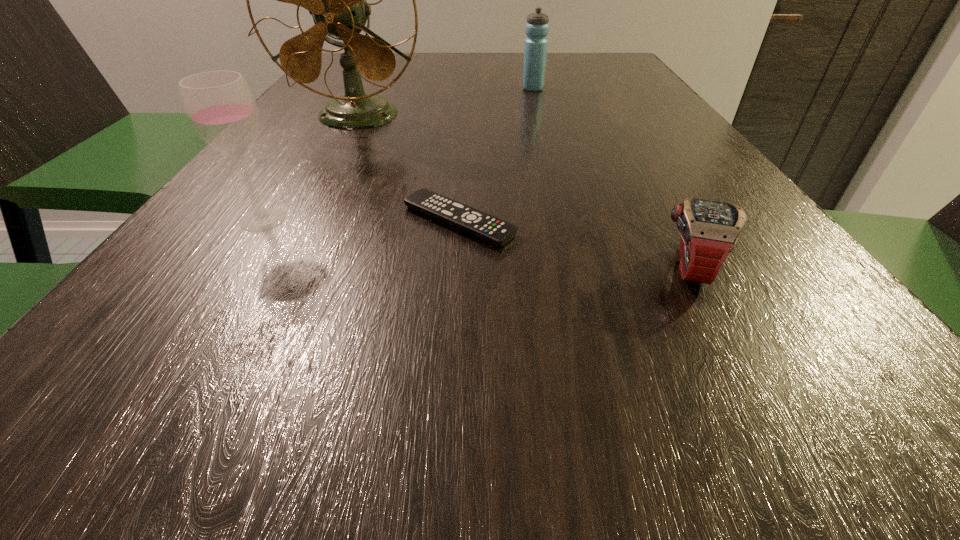
Where is `the tallest object`? The width and height of the screenshot is (960, 540). the tallest object is located at coordinates (336, 0).

Find the location of `the second farthest object`. the second farthest object is located at coordinates (336, 0).

The image size is (960, 540). Find the location of `wineglass`. wineglass is located at coordinates (220, 106).

Locate an element on the screen. This screenshot has height=540, width=960. water bottle is located at coordinates (535, 47).

I want to click on the fourth object from left to right, so click(535, 47).

I want to click on watch, so [x=709, y=230].

This screenshot has width=960, height=540. What are the coordinates of `the rightmost object` in the screenshot? It's located at (709, 230).

This screenshot has width=960, height=540. Identify the location of remote control. (489, 228).

Identify the location of vacant region located in front of the tallest object, directing air flow. Image resolution: width=960 pixels, height=540 pixels. (328, 169).

Locate an element on the screen. free space located 0.270m on the front of the wineglass is located at coordinates (140, 405).